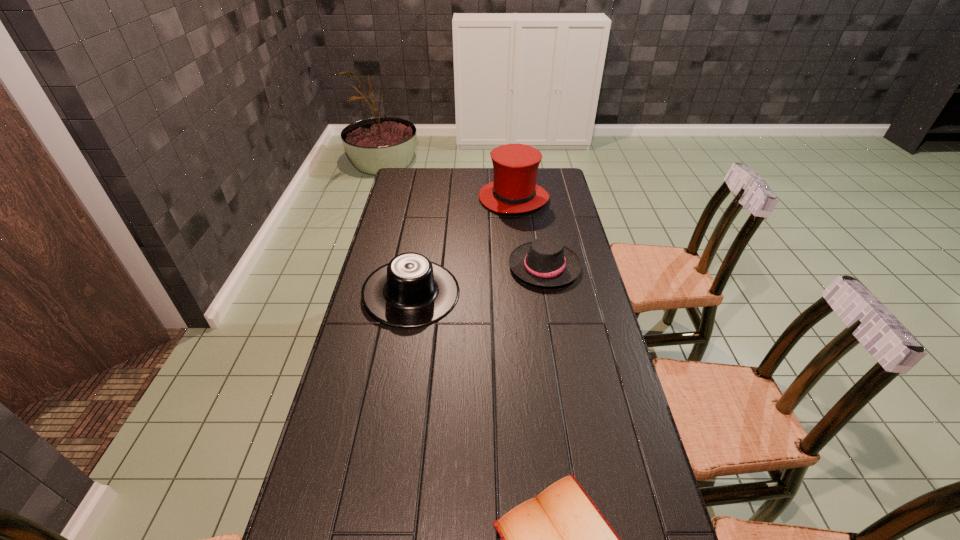
You are a GUI agent. You are given a task and a screenshot of the screen. Output one action in this format:
    pyautogui.click(x=<x>, y=<y>)
    Task: Click on the tallest object
    The height and width of the screenshot is (540, 960).
    Given the screenshot: What is the action you would take?
    pyautogui.click(x=514, y=190)

You are a GUI agent. You are given a task and a screenshot of the screen. Output one action in this format:
    pyautogui.click(x=<x>, y=<y>)
    Task: Click on the farthest dress hat
    
    Given the screenshot: What is the action you would take?
    pyautogui.click(x=514, y=190)

At what (x,y) coordinates should I click in order to perform the action: click on the leftmost dress hat. Please return your answer as a coordinate pair (x, y). Looking at the image, I should click on (410, 291).

Identify the location of the third shortest object. The image size is (960, 540). (410, 291).

Where is `the shortest dress hat`? Image resolution: width=960 pixels, height=540 pixels. the shortest dress hat is located at coordinates (546, 262).

I want to click on free region located on the left of the farthest object, so click(428, 198).

Find the location of `vacant space situated 0.070m on the back of the third shortest object`. vacant space situated 0.070m on the back of the third shortest object is located at coordinates (419, 251).

What are the coordinates of `free region located on the left of the shortest dress hat` in the screenshot? It's located at (415, 266).

This screenshot has height=540, width=960. In order to click on object that is at the far edge in this screenshot , I will do `click(514, 190)`.

Locate an element on the screen. object positioned at the left edge is located at coordinates (410, 291).